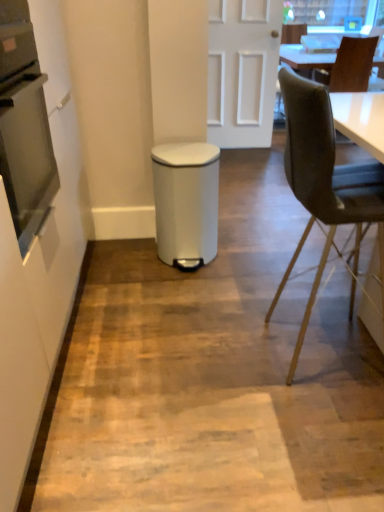
What do you see at coordinates (24, 126) in the screenshot? I see `stainless steel oven at left` at bounding box center [24, 126].

Describe the element at coordinates (349, 66) in the screenshot. The image size is (384, 512). I see `brown leather chair at upper right, placed as the second chair when sorted from front to back` at that location.

Identify the location of white matte door at center. This screenshot has width=384, height=512. (242, 71).

Image resolution: width=384 pixels, height=512 pixels. What do you see at coordinates (186, 202) in the screenshot? I see `white plastic waste bin at center` at bounding box center [186, 202].

Where is `velvet black chair at right, positioned as the first chair in front-to-back order`? Image resolution: width=384 pixels, height=512 pixels. velvet black chair at right, positioned as the first chair in front-to-back order is located at coordinates (323, 182).

Looking at this image, is white matte trash can at center smaller than white plastic waste bin at center?

No, white matte trash can at center is not smaller than white plastic waste bin at center.

From a real-world perspective, is white matte trash can at center positioned under white plastic waste bin at center based on gravity?

Actually, white matte trash can at center is physically above white plastic waste bin at center in the real world.

Is white matte trash can at center wider or thinner than white plastic waste bin at center?

Clearly, white matte trash can at center has more width compared to white plastic waste bin at center.

Relative to white plastic waste bin at center, is white matte trash can at center in front or behind?

Visually, white matte trash can at center is located in front of white plastic waste bin at center.

Based on the photo, which object is thinner, white plastic waste bin at center or stainless steel oven at left?

stainless steel oven at left is thinner.

Find the location of a particular element. waste container behind the stainless steel oven at left is located at coordinates tap(186, 202).

Between white plastic waste bin at center and stainless steel oven at left, which one has more height?

With more height is white plastic waste bin at center.

Does white plastic waste bin at center lie behind stainless steel oven at left?

Yes.

Is point (11, 197) positioned before point (289, 371)?

Yes, it is.

From the image's perspective, which object appears higher, stainless steel oven at left or velvet black chair at right, positioned as the first chair in front-to-back order?

stainless steel oven at left appears higher in the image.

Is stainless steel oven at left beside velvet black chair at right, acting as the 2th chair starting from the top?

No, stainless steel oven at left is not next to velvet black chair at right, acting as the 2th chair starting from the top.

Choose the correct answer: Is stainless steel oven at left inside velvet black chair at right, placed as the second chair when sorted from right to left, or outside it?

stainless steel oven at left is outside velvet black chair at right, placed as the second chair when sorted from right to left.

Locate an element on the screen. door that is above the white matte trash can at center (from the image's perspective) is located at coordinates (242, 71).

Considering the sizes of objects white matte door at center and white matte trash can at center in the image provided, who is bigger, white matte door at center or white matte trash can at center?

With larger size is white matte trash can at center.

From the image's perspective, which one is positioned lower, white matte door at center or white matte trash can at center?

white matte trash can at center appears lower in the image.

Can you confirm if white matte door at center is taller than white matte trash can at center?

No, white matte door at center is not taller than white matte trash can at center.

Image resolution: width=384 pixels, height=512 pixels. In the image, there is a white matte door at center. Identify the location of waste container below it (from a real-world perspective). (186, 202).

Considering the sizes of objects white plastic waste bin at center and white matte door at center in the image provided, who is wider, white plastic waste bin at center or white matte door at center?

white plastic waste bin at center is wider.

Is white plastic waste bin at center far from white matte door at center?

white plastic waste bin at center is far away from white matte door at center.

Who is smaller, white plastic waste bin at center or white matte door at center?

Smaller between the two is white plastic waste bin at center.

Is velvet black chair at right, arranged as the 2th chair when viewed from the back, beside stainless steel oven at left?

They are not placed beside each other.

Can you confirm if velvet black chair at right, positioned as the first chair in front-to-back order, is positioned to the left of stainless steel oven at left?

No, velvet black chair at right, positioned as the first chair in front-to-back order, is not to the left of stainless steel oven at left.

Is velvet black chair at right, positioned as the first chair in bottom-to-top order, located outside stainless steel oven at left?

That's correct, velvet black chair at right, positioned as the first chair in bottom-to-top order, is outside of stainless steel oven at left.

Could you measure the distance between velvet black chair at right, arranged as the 2th chair when viewed from the back, and stainless steel oven at left?

velvet black chair at right, arranged as the 2th chair when viewed from the back, and stainless steel oven at left are 38.16 inches apart from each other.

Which object is thinner, white matte trash can at center or velvet black chair at right, which appears as the 1th chair when viewed from the left?

With smaller width is white matte trash can at center.

From the picture: Relative to velvet black chair at right, acting as the 2th chair starting from the top, is white matte trash can at center in front or behind?

white matte trash can at center is in front of velvet black chair at right, acting as the 2th chair starting from the top.

Could you tell me if white matte trash can at center is turned towards velvet black chair at right, positioned as the first chair in front-to-back order?

Yes, white matte trash can at center is facing velvet black chair at right, positioned as the first chair in front-to-back order.

Could you measure the distance between white matte trash can at center and velvet black chair at right, placed as the second chair when sorted from right to left?

98.72 centimeters.

Identify the location of side that appears below the white plastic waste bin at center (from the image's perspective). (40, 268).

Locate an element on the screen. Image resolution: width=384 pixels, height=512 pixels. oven in front of the white plastic waste bin at center is located at coordinates (24, 126).

From the image, which object appears to be nearer to white matte trash can at center, white matte door at center or white plastic waste bin at center?

white plastic waste bin at center.

Which object lies further to the anchor point white plastic waste bin at center, white matte door at center or brown leather chair at upper right, which appears as the 1th chair when viewed from the top?

brown leather chair at upper right, which appears as the 1th chair when viewed from the top, is positioned further to the anchor white plastic waste bin at center.

Looking at the image, which one is located further to velvet black chair at right, placed as the second chair when sorted from right to left, white matte trash can at center or white plastic waste bin at center?

white matte trash can at center lies further to velvet black chair at right, placed as the second chair when sorted from right to left, than the other object.

Looking at the image, which one is located closer to white matte trash can at center, velvet black chair at right, positioned as the first chair in front-to-back order, or brown leather chair at upper right, placed as the second chair when sorted from bottom to top?

velvet black chair at right, positioned as the first chair in front-to-back order, lies closer to white matte trash can at center than the other object.

Consider the image. Considering their positions, is white matte trash can at center positioned closer to white matte door at center than velvet black chair at right, acting as the 2th chair starting from the top?

Based on the image, velvet black chair at right, acting as the 2th chair starting from the top, appears to be nearer to white matte door at center.

Based on their spatial positions, is brown leather chair at upper right, acting as the 1th chair starting from the back, or white plastic waste bin at center closer to velvet black chair at right, positioned as the first chair in front-to-back order?

white plastic waste bin at center is closer to velvet black chair at right, positioned as the first chair in front-to-back order.

When comparing their distances from stainless steel oven at left, does velvet black chair at right, which appears as the 1th chair when viewed from the left, or white matte trash can at center seem further?

velvet black chair at right, which appears as the 1th chair when viewed from the left, is further to stainless steel oven at left.

Based on their spatial positions, is stainless steel oven at left or white plastic waste bin at center closer to velvet black chair at right, positioned as the first chair in bottom-to-top order?

white plastic waste bin at center is closer to velvet black chair at right, positioned as the first chair in bottom-to-top order.

The width and height of the screenshot is (384, 512). Find the location of `chair located between white matte trash can at center and white plastic waste bin at center in the depth direction`. chair located between white matte trash can at center and white plastic waste bin at center in the depth direction is located at coordinates (323, 182).

Find the location of a particular element. This screenshot has width=384, height=512. chair between stainless steel oven at left and white plastic waste bin at center in the front-back direction is located at coordinates (323, 182).

Find the location of a particular element. This screenshot has width=384, height=512. door between white matte trash can at center and brown leather chair at upper right, placed as the 2th chair when sorted from left to right, along the z-axis is located at coordinates (242, 71).

At what (x,y) coordinates should I click in order to perform the action: click on door positioned between velvet black chair at right, positioned as the first chair in bottom-to-top order, and brown leather chair at upper right, which is the first chair from right to left, from near to far. Please return your answer as a coordinate pair (x, y). This screenshot has width=384, height=512. Looking at the image, I should click on (242, 71).